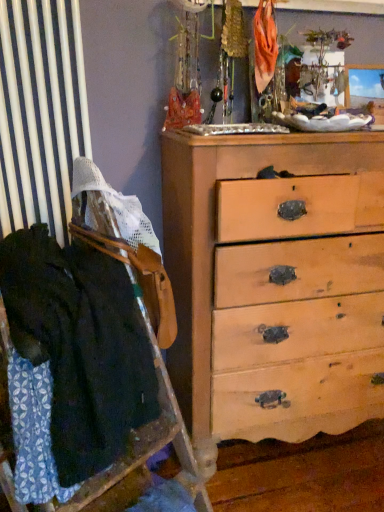
Question: Should I look upward or downward to see dark blue fabric at left?

Choices:
 (A) up
 (B) down

Answer: (B)

Question: Can you confirm if dark blue fabric at left is positioned to the right of light brown wooden chest of drawers at center?

Choices:
 (A) no
 (B) yes

Answer: (A)

Question: Could light brown wooden chest of drawers at center be considered to be inside dark blue fabric at left?

Choices:
 (A) no
 (B) yes

Answer: (A)

Question: Does dark blue fabric at left have a greater width compared to light brown wooden chest of drawers at center?

Choices:
 (A) no
 (B) yes

Answer: (A)

Question: Considering the relative sizes of dark blue fabric at left and light brown wooden chest of drawers at center in the image provided, is dark blue fabric at left taller than light brown wooden chest of drawers at center?

Choices:
 (A) no
 (B) yes

Answer: (A)

Question: Is dark blue fabric at left facing away from light brown wooden chest of drawers at center?

Choices:
 (A) yes
 (B) no

Answer: (B)

Question: Is dark blue fabric at left located outside light brown wooden chest of drawers at center?

Choices:
 (A) yes
 (B) no

Answer: (A)

Question: From the image's perspective, would you say light brown wooden chest of drawers at center is shown under dark blue fabric at left?

Choices:
 (A) no
 (B) yes

Answer: (A)

Question: Is the position of light brown wooden chest of drawers at center less distant than that of dark blue fabric at left?

Choices:
 (A) no
 (B) yes

Answer: (A)

Question: Does light brown wooden chest of drawers at center appear on the left side of dark blue fabric at left?

Choices:
 (A) no
 (B) yes

Answer: (A)

Question: Is light brown wooden chest of drawers at center oriented towards dark blue fabric at left?

Choices:
 (A) no
 (B) yes

Answer: (A)

Question: From a real-world perspective, is light brown wooden chest of drawers at center beneath dark blue fabric at left?

Choices:
 (A) no
 (B) yes

Answer: (B)

Question: Is light brown wooden chest of drawers at center at the right side of dark blue fabric at left?

Choices:
 (A) no
 (B) yes

Answer: (B)

Question: Is light brown wooden chest of drawers at center taller or shorter than dark blue fabric at left?

Choices:
 (A) short
 (B) tall

Answer: (B)